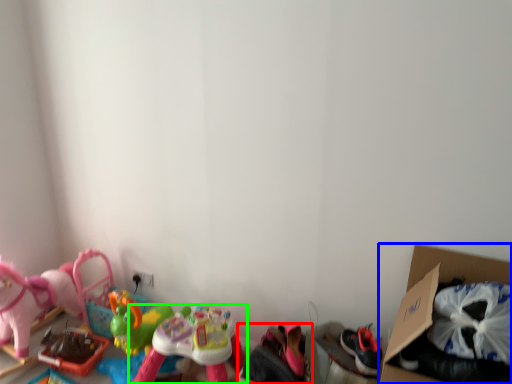
Question: Based on their relative distances, which object is farther from toy (highlighted by a red box)? Choose from cardboard box (highlighted by a blue box) and toy (highlighted by a green box).

Choices:
 (A) cardboard box
 (B) toy

Answer: (A)